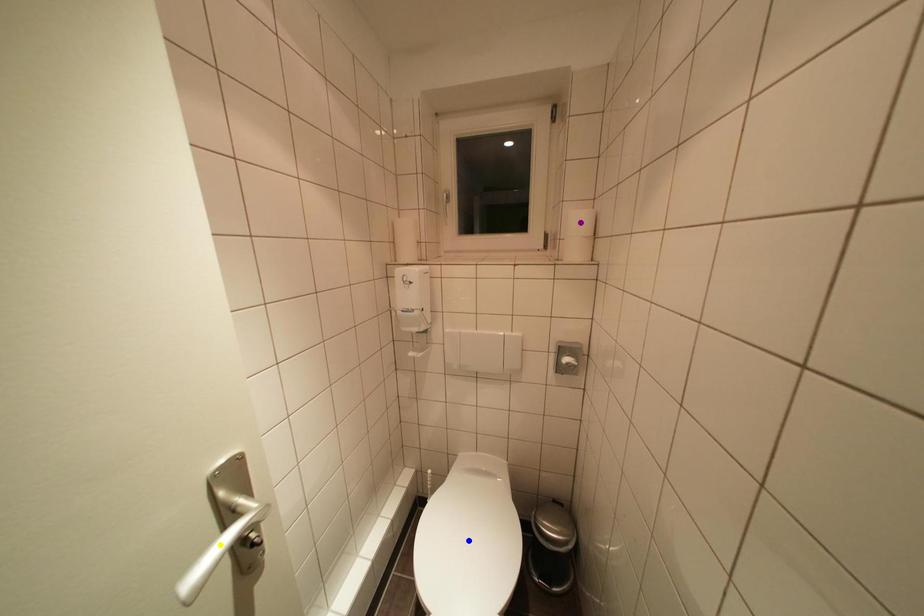
Order these from farthest to nearest:
blue point | purple point | yellow point

purple point, blue point, yellow point